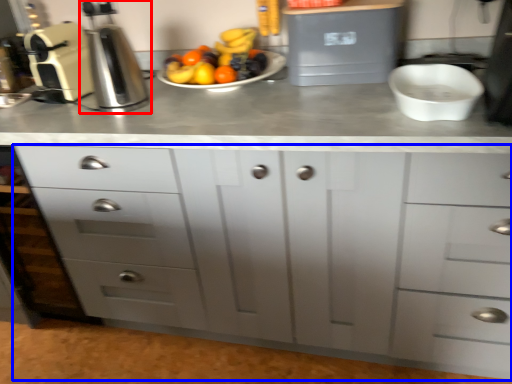
Question: Which point is closer to the camera, coffee machine (highlighted by a red box) or chest of drawers (highlighted by a blue box)?

Choices:
 (A) coffee machine
 (B) chest of drawers

Answer: (B)